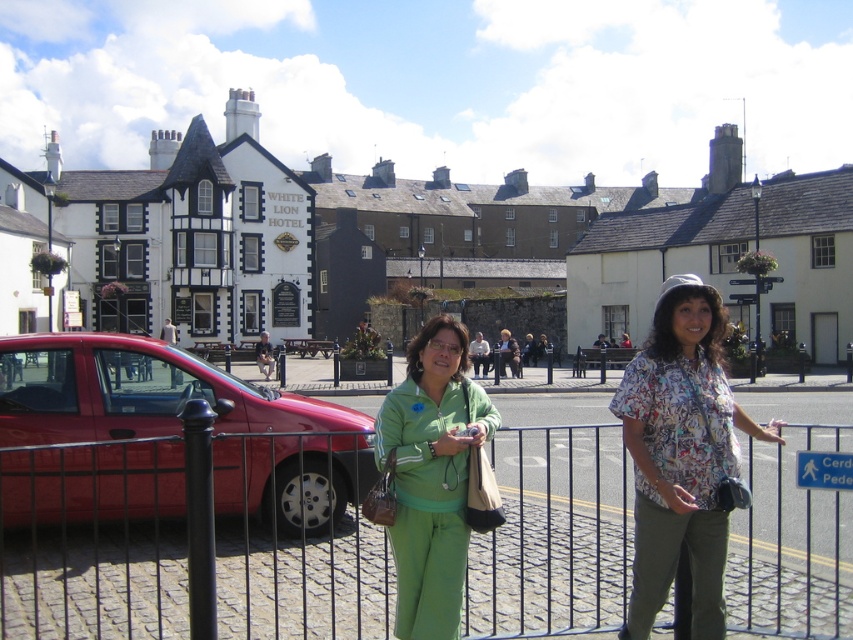
Question: Which point appears farthest from the camera in this image?

Choices:
 (A) (102, 372)
 (B) (440, 518)
 (C) (527, 458)

Answer: (C)

Question: Considering the relative positions of black metal fence at center and green matte tracksuit at center in the image provided, where is black metal fence at center located with respect to green matte tracksuit at center?

Choices:
 (A) right
 (B) left

Answer: (A)

Question: Which object appears closest to the camera in this image?

Choices:
 (A) shiny red car at left
 (B) printed fabric shirt at center
 (C) black metal fence at center
 (D) green matte tracksuit at center

Answer: (B)

Question: Does black metal fence at center have a smaller size compared to printed fabric shirt at center?

Choices:
 (A) no
 (B) yes

Answer: (A)

Question: Is the position of printed fabric shirt at center less distant than that of green matte tracksuit at center?

Choices:
 (A) no
 (B) yes

Answer: (B)

Question: Which point is closer to the camera taking this photo?

Choices:
 (A) (440, 474)
 (B) (548, 557)
 (C) (202, 372)

Answer: (A)